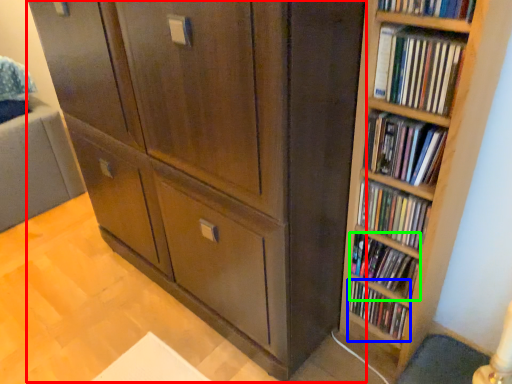
Question: Estimate the real-world distances between objects in this image. Which object is farther from cupboard (highlighted by a red box), book (highlighted by a blue box) or book (highlighted by a green box)?

Choices:
 (A) book
 (B) book

Answer: (A)